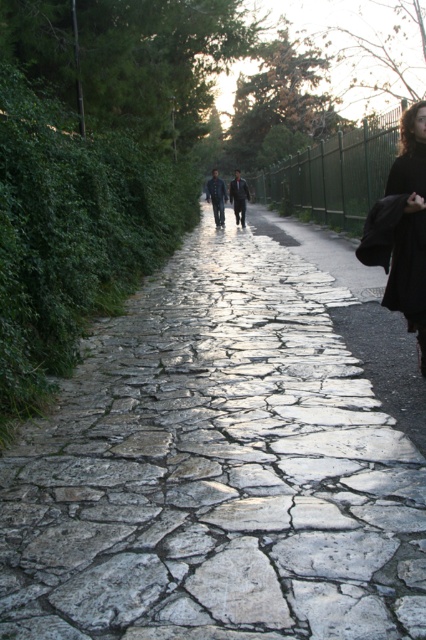
Does black matte dress at right have a smaller size compared to dark blue jeans at center?

Correct, black matte dress at right occupies less space than dark blue jeans at center.

Does black matte dress at right appear under dark blue jeans at center?

Correct, black matte dress at right is located below dark blue jeans at center.

Where is `black matte dress at right`? black matte dress at right is located at coordinates (408, 269).

Does cracked stone pavement at center have a greater height compared to black matte dress at right?

Yes.

Based on the photo, between cracked stone pavement at center and black matte dress at right, which one appears on the right side from the viewer's perspective?

From the viewer's perspective, black matte dress at right appears more on the right side.

The image size is (426, 640). I want to click on cracked stone pavement at center, so pyautogui.click(x=215, y=470).

Identify the location of cracked stone pavement at center. This screenshot has height=640, width=426. (215, 470).

Based on the photo, can you confirm if cracked stone pavement at center is positioned below black wool coat at right?

Yes.

Is cracked stone pavement at center bigger than black wool coat at right?

Correct, cracked stone pavement at center is larger in size than black wool coat at right.

Is point (109, 465) in front of point (391, 280)?

Yes.

Identify the location of cracked stone pavement at center. (215, 470).